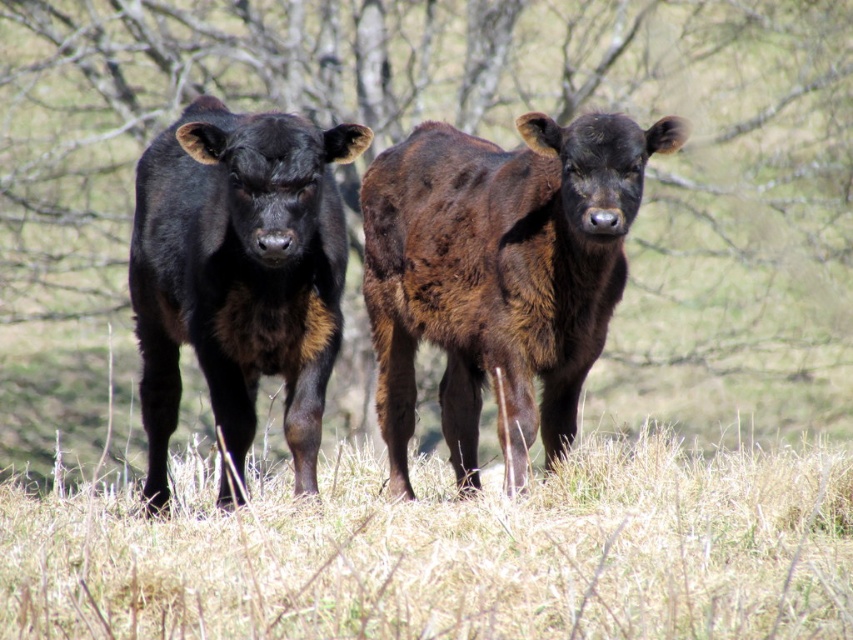
Question: Which point is closer to the camera?

Choices:
 (A) black glossy cow at center
 (B) dry grass at lower center

Answer: (B)

Question: Which of the following is the farthest from the observer?

Choices:
 (A) dry grass at lower center
 (B) black glossy cow at center
 (C) shiny brown calf at center

Answer: (C)

Question: Which object is farther from the camera taking this photo?

Choices:
 (A) black glossy cow at center
 (B) dry grass at lower center
 (C) shiny brown calf at center

Answer: (C)

Question: Can you confirm if shiny brown calf at center is bigger than black glossy cow at center?

Choices:
 (A) yes
 (B) no

Answer: (A)

Question: Does dry grass at lower center have a smaller size compared to shiny brown calf at center?

Choices:
 (A) yes
 (B) no

Answer: (A)

Question: Can you confirm if shiny brown calf at center is wider than black glossy cow at center?

Choices:
 (A) no
 (B) yes

Answer: (B)